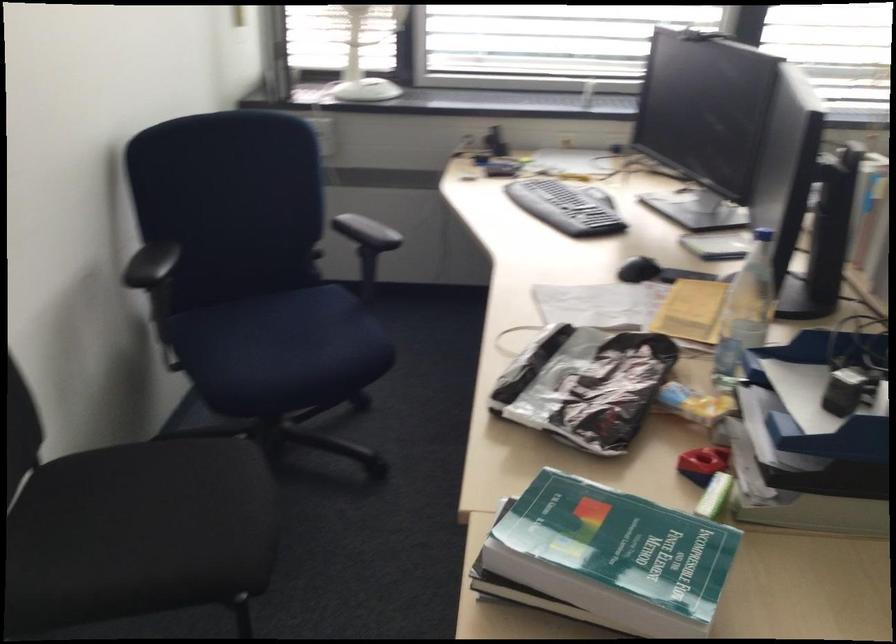
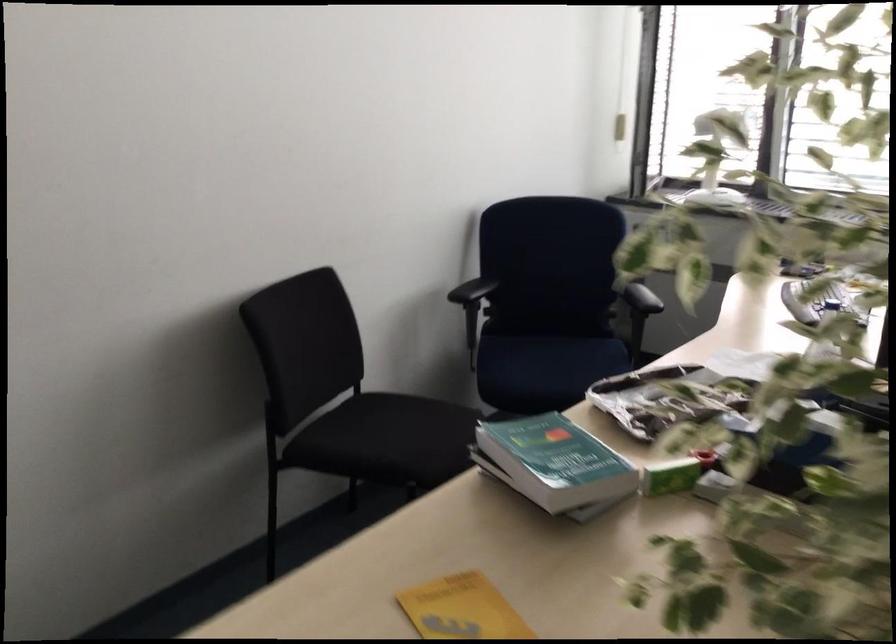
Find the pixel in the second image that matches [153,542] in the first image.

(377, 436)